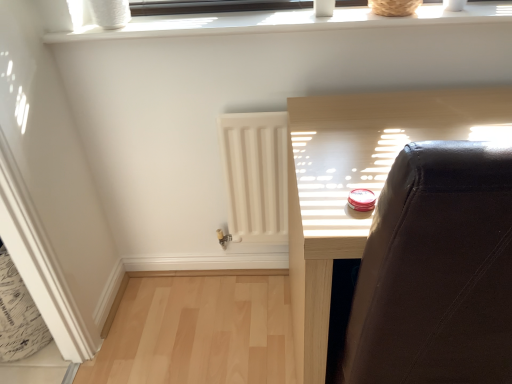
Find the location of a particular element. The width and height of the screenshot is (512, 384). matte black chair at upper right is located at coordinates (359, 181).

The width and height of the screenshot is (512, 384). What are the coordinates of `white matte radiator at center` in the screenshot? It's located at (256, 175).

What is the approximate width of dark brown wood window frame at upper center, which appears as the 2th window frame when ordered from the bottom?

The width of dark brown wood window frame at upper center, which appears as the 2th window frame when ordered from the bottom, is 4.18 inches.

The image size is (512, 384). Identify the location of matte black chair at upper right. (359, 181).

Is white matte radiator at center aimed at dark brown wood window frame at upper center, which appears as the 2th window frame when ordered from the bottom?

No, white matte radiator at center is not turned towards dark brown wood window frame at upper center, which appears as the 2th window frame when ordered from the bottom.

Can you confirm if white matte radiator at center is positioned to the left of dark brown wood window frame at upper center, which appears as the 2th window frame when ordered from the bottom?

Yes.

Is white matte radiator at center beside dark brown wood window frame at upper center, which appears as the 2th window frame when ordered from the bottom?

No, white matte radiator at center is not with dark brown wood window frame at upper center, which appears as the 2th window frame when ordered from the bottom.

Locate an element on the screen. This screenshot has height=384, width=512. the 2nd window frame directly above the white matte radiator at center (from a real-world perspective) is located at coordinates (214, 6).

Which of these two, dark brown wood window frame at upper center, the 1th window frame when ordered from top to bottom, or white plastic window frame at upper center, which is the first window frame from bottom to top, stands taller?

With more height is white plastic window frame at upper center, which is the first window frame from bottom to top.

Based on their sizes in the image, would you say dark brown wood window frame at upper center, the 1th window frame when ordered from top to bottom, is bigger or smaller than white plastic window frame at upper center, the 2th window frame from the top?

Considering their sizes, dark brown wood window frame at upper center, the 1th window frame when ordered from top to bottom, takes up less space than white plastic window frame at upper center, the 2th window frame from the top.

Is dark brown wood window frame at upper center, which appears as the 2th window frame when ordered from the bottom, in front of white plastic window frame at upper center, the 2th window frame from the top?

No, dark brown wood window frame at upper center, which appears as the 2th window frame when ordered from the bottom, is further to the viewer.

From a real-world perspective, relative to white plastic window frame at upper center, which is the first window frame from bottom to top, is dark brown wood window frame at upper center, the 1th window frame when ordered from top to bottom, vertically above or below?

dark brown wood window frame at upper center, the 1th window frame when ordered from top to bottom, is situated higher than white plastic window frame at upper center, which is the first window frame from bottom to top, in the real world.

Is white matte radiator at center positioned far away from white plastic window frame at upper center, the 2th window frame from the top?

No, white matte radiator at center is not far from white plastic window frame at upper center, the 2th window frame from the top.

Measure the distance from white matte radiator at center to white plastic window frame at upper center, the 2th window frame from the top.

The distance of white matte radiator at center from white plastic window frame at upper center, the 2th window frame from the top, is 17.30 inches.

From the image's perspective, is white matte radiator at center above white plastic window frame at upper center, the 2th window frame from the top?

No, from the image's perspective, white matte radiator at center is not over white plastic window frame at upper center, the 2th window frame from the top.

Which is in front, white matte radiator at center or white plastic window frame at upper center, the 2th window frame from the top?

white plastic window frame at upper center, the 2th window frame from the top, is more forward.

From a real-world perspective, is white plastic window frame at upper center, which is the first window frame from bottom to top, on dark brown wood window frame at upper center, the 1th window frame when ordered from top to bottom?

No, from a real-world perspective, white plastic window frame at upper center, which is the first window frame from bottom to top, is not over dark brown wood window frame at upper center, the 1th window frame when ordered from top to bottom

What's the angular difference between white plastic window frame at upper center, the 2th window frame from the top, and dark brown wood window frame at upper center, the 1th window frame when ordered from top to bottom,'s facing directions?

The angle between the facing direction of white plastic window frame at upper center, the 2th window frame from the top, and the facing direction of dark brown wood window frame at upper center, the 1th window frame when ordered from top to bottom, is 0.488 degrees.

Is white plastic window frame at upper center, the 2th window frame from the top, next to dark brown wood window frame at upper center, the 1th window frame when ordered from top to bottom?

No.

Between point (458, 16) and point (365, 0), which one is positioned in front?

Point (458, 16)

Is matte black chair at upper right beside dark brown wood window frame at upper center, the 1th window frame when ordered from top to bottom?

They are not placed beside each other.

Which is more to the right, matte black chair at upper right or dark brown wood window frame at upper center, which appears as the 2th window frame when ordered from the bottom?

matte black chair at upper right is more to the right.

Considering the relative positions of matte black chair at upper right and dark brown wood window frame at upper center, which appears as the 2th window frame when ordered from the bottom, in the image provided, is matte black chair at upper right behind dark brown wood window frame at upper center, which appears as the 2th window frame when ordered from the bottom,?

No.

Is matte black chair at upper right shorter than dark brown wood window frame at upper center, which appears as the 2th window frame when ordered from the bottom?

In fact, matte black chair at upper right may be taller than dark brown wood window frame at upper center, which appears as the 2th window frame when ordered from the bottom.

Considering the relative positions of matte black chair at upper right and white plastic window frame at upper center, which is the first window frame from bottom to top, in the image provided, is matte black chair at upper right to the right of white plastic window frame at upper center, which is the first window frame from bottom to top, from the viewer's perspective?

Yes, matte black chair at upper right is to the right of white plastic window frame at upper center, which is the first window frame from bottom to top.

Does matte black chair at upper right come in front of white plastic window frame at upper center, the 2th window frame from the top?

Yes, matte black chair at upper right is in front of white plastic window frame at upper center, the 2th window frame from the top.

Can you tell me how much matte black chair at upper right and white plastic window frame at upper center, the 2th window frame from the top, differ in facing direction?

2.03 degrees separate the facing orientations of matte black chair at upper right and white plastic window frame at upper center, the 2th window frame from the top.

Between matte black chair at upper right and white plastic window frame at upper center, the 2th window frame from the top, which one has smaller width?

With smaller width is white plastic window frame at upper center, the 2th window frame from the top.

Would you say white plastic window frame at upper center, which is the first window frame from bottom to top, is inside or outside white matte radiator at center?

white plastic window frame at upper center, which is the first window frame from bottom to top, is located beyond the bounds of white matte radiator at center.

From the picture: Considering the relative sizes of white plastic window frame at upper center, which is the first window frame from bottom to top, and white matte radiator at center in the image provided, is white plastic window frame at upper center, which is the first window frame from bottom to top, taller than white matte radiator at center?

Incorrect, the height of white plastic window frame at upper center, which is the first window frame from bottom to top, is not larger of that of white matte radiator at center.

Does white plastic window frame at upper center, the 2th window frame from the top, appear on the left side of white matte radiator at center?

No.

Which object is thinner, white plastic window frame at upper center, the 2th window frame from the top, or white matte radiator at center?

Thinner between the two is white matte radiator at center.

Where is `radiator lying on the left of dark brown wood window frame at upper center, which appears as the 2th window frame when ordered from the bottom`? radiator lying on the left of dark brown wood window frame at upper center, which appears as the 2th window frame when ordered from the bottom is located at coordinates (256, 175).

The image size is (512, 384). I want to click on window frame below the dark brown wood window frame at upper center, the 1th window frame when ordered from top to bottom (from the image's perspective), so click(285, 22).

Which object lies further to the anchor point matte black chair at upper right, white plastic window frame at upper center, the 2th window frame from the top, or dark brown wood window frame at upper center, which appears as the 2th window frame when ordered from the bottom?

dark brown wood window frame at upper center, which appears as the 2th window frame when ordered from the bottom, is further to matte black chair at upper right.

Based on their spatial positions, is matte black chair at upper right or dark brown wood window frame at upper center, the 1th window frame when ordered from top to bottom, further from white plastic window frame at upper center, which is the first window frame from bottom to top?

matte black chair at upper right.

Looking at the image, which one is located further to white plastic window frame at upper center, which is the first window frame from bottom to top, dark brown wood window frame at upper center, which appears as the 2th window frame when ordered from the bottom, or matte black chair at upper right?

Based on the image, matte black chair at upper right appears to be further to white plastic window frame at upper center, which is the first window frame from bottom to top.

When comparing their distances from matte black chair at upper right, does dark brown wood window frame at upper center, which appears as the 2th window frame when ordered from the bottom, or white matte radiator at center seem further?

dark brown wood window frame at upper center, which appears as the 2th window frame when ordered from the bottom.

Which object lies nearer to the anchor point white plastic window frame at upper center, which is the first window frame from bottom to top, white matte radiator at center or matte black chair at upper right?

matte black chair at upper right lies closer to white plastic window frame at upper center, which is the first window frame from bottom to top, than the other object.

Which object lies nearer to the anchor point matte black chair at upper right, white plastic window frame at upper center, the 2th window frame from the top, or white matte radiator at center?

white matte radiator at center lies closer to matte black chair at upper right than the other object.

Which object lies further to the anchor point white plastic window frame at upper center, which is the first window frame from bottom to top, white matte radiator at center or dark brown wood window frame at upper center, which appears as the 2th window frame when ordered from the bottom?

The object further to white plastic window frame at upper center, which is the first window frame from bottom to top, is white matte radiator at center.

Looking at this image, estimate the real-world distances between objects in this image. Which object is further from white matte radiator at center, matte black chair at upper right or dark brown wood window frame at upper center, which appears as the 2th window frame when ordered from the bottom?

Based on the image, dark brown wood window frame at upper center, which appears as the 2th window frame when ordered from the bottom, appears to be further to white matte radiator at center.

The width and height of the screenshot is (512, 384). What are the coordinates of `radiator between white plastic window frame at upper center, which is the first window frame from bottom to top, and matte black chair at upper right vertically` in the screenshot? It's located at (256, 175).

What are the coordinates of `window frame between dark brown wood window frame at upper center, which appears as the 2th window frame when ordered from the bottom, and white matte radiator at center, in the vertical direction` in the screenshot? It's located at 285,22.

Locate an element on the screen. This screenshot has height=384, width=512. window frame between dark brown wood window frame at upper center, the 1th window frame when ordered from top to bottom, and matte black chair at upper right from top to bottom is located at coordinates (285, 22).

The height and width of the screenshot is (384, 512). What are the coordinates of `radiator that lies between dark brown wood window frame at upper center, which appears as the 2th window frame when ordered from the bottom, and matte black chair at upper right from top to bottom` in the screenshot? It's located at (256, 175).